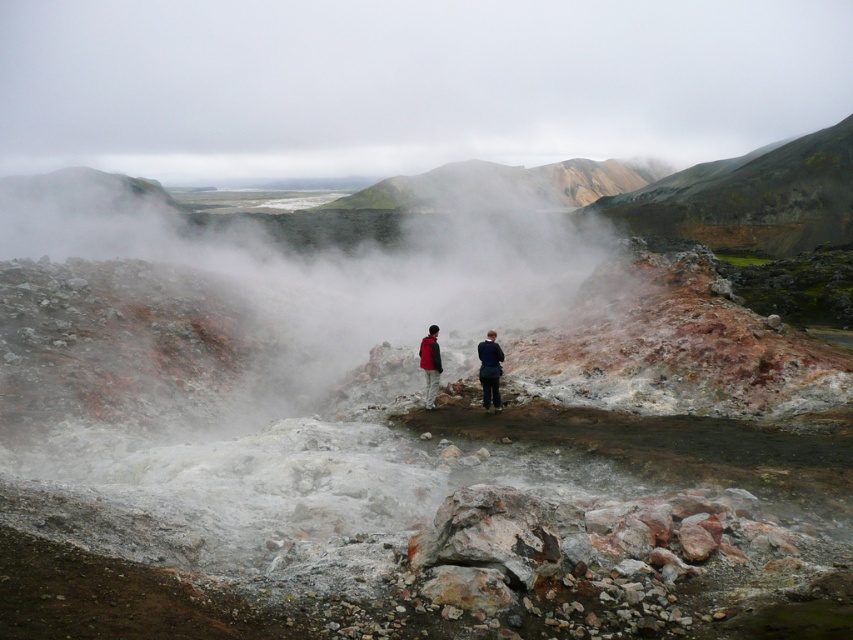
Question: Can you confirm if white fog at center is positioned to the right of rustic volcanic rock at upper center?

Choices:
 (A) yes
 (B) no

Answer: (B)

Question: Among these points, which one is nearest to the camera?

Choices:
 (A) (343, 305)
 (B) (161, 96)

Answer: (A)

Question: Does white fog at center appear on the left side of dark blue fabric jacket at center?

Choices:
 (A) no
 (B) yes

Answer: (B)

Question: Which object appears farthest from the camera in this image?

Choices:
 (A) rustic volcanic rock at upper center
 (B) white fog at center
 (C) white fog at upper center

Answer: (C)

Question: Which is nearer to the white fog at center?

Choices:
 (A) rustic volcanic rock at upper center
 (B) red jacket at center
 (C) white fog at upper center

Answer: (A)

Question: From the image, what is the correct spatial relationship of dark blue fabric jacket at center in relation to red jacket at center?

Choices:
 (A) left
 (B) right

Answer: (B)